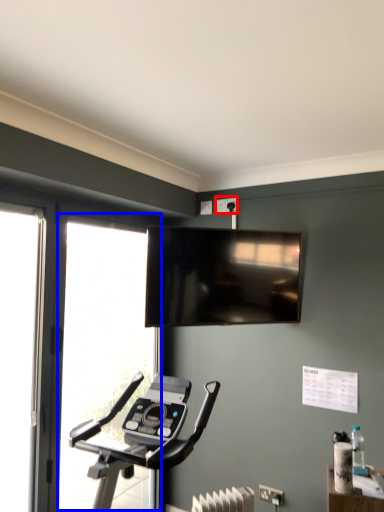
Question: Which of the following is the farthest to the observer, electric outlet (highlighted by a red box) or window (highlighted by a blue box)?

Choices:
 (A) electric outlet
 (B) window

Answer: (A)